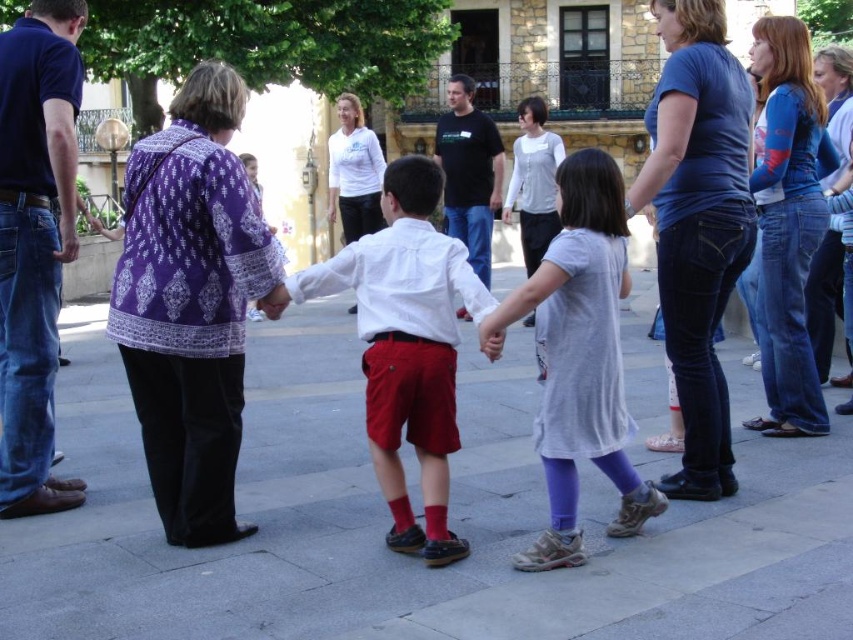
Is purple printed blouse at left to the right of light gray cotton dress at center from the viewer's perspective?

In fact, purple printed blouse at left is to the left of light gray cotton dress at center.

From the picture: Is purple printed blouse at left to the left of light gray cotton dress at center from the viewer's perspective?

Indeed, purple printed blouse at left is positioned on the left side of light gray cotton dress at center.

This screenshot has width=853, height=640. In order to click on purple printed blouse at left in this screenshot , I will do `click(190, 301)`.

Between point (492, 141) and point (398, 502), which one is positioned behind?

Positioned behind is point (492, 141).

Can you confirm if black cotton shirt at center is taller than red matte sock at lower center?

Yes, black cotton shirt at center is taller than red matte sock at lower center.

What do you see at coordinates (469, 172) in the screenshot? This screenshot has width=853, height=640. I see `black cotton shirt at center` at bounding box center [469, 172].

Where is `black cotton shirt at center`? Image resolution: width=853 pixels, height=640 pixels. black cotton shirt at center is located at coordinates (469, 172).

Can you confirm if black cotton shirt at center is positioned above red cotton sock at lower center?

Indeed, black cotton shirt at center is positioned over red cotton sock at lower center.

Consider the image. Does black cotton shirt at center appear on the right side of red cotton sock at lower center?

Correct, you'll find black cotton shirt at center to the right of red cotton sock at lower center.

Which is behind, point (471, 141) or point (434, 536)?

Point (471, 141)

Identify the location of black cotton shirt at center. The width and height of the screenshot is (853, 640). (469, 172).